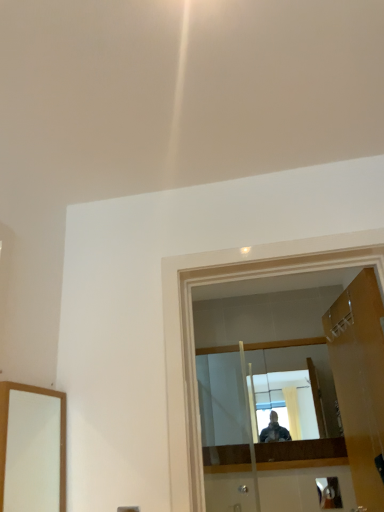
The width and height of the screenshot is (384, 512). Describe the element at coordinates (194, 346) in the screenshot. I see `transparent glass door at center` at that location.

What are the coordinates of `metallic silver door handle at lower right` in the screenshot? It's located at (329, 493).

Is wooden door at right located outside metallic silver door handle at lower right?

Yes, wooden door at right is not within metallic silver door handle at lower right.

From a real-world perspective, who is located higher, wooden door at right or metallic silver door handle at lower right?

In real-world perspective, wooden door at right is above.

From the image's perspective, is wooden door at right on metallic silver door handle at lower right?

Yes, from the image's perspective, wooden door at right is on top of metallic silver door handle at lower right.

How far apart are wooden door at right and metallic silver door handle at lower right?

wooden door at right is 4.14 feet away from metallic silver door handle at lower right.

Is transparent glass door at center facing away from metallic silver door handle at lower right?

Yes, transparent glass door at center is positioned with its back facing metallic silver door handle at lower right.

How much distance is there between transparent glass door at center and metallic silver door handle at lower right?

transparent glass door at center is 6.04 feet from metallic silver door handle at lower right.

Is transparent glass door at center surrounding metallic silver door handle at lower right?

Actually, metallic silver door handle at lower right is outside transparent glass door at center.

I want to click on glass door that is on the left side of metallic silver door handle at lower right, so click(194, 346).

Which is in front, wooden door at right or transparent glass door at center?

Positioned in front is transparent glass door at center.

Considering the relative sizes of wooden door at right and transparent glass door at center in the image provided, is wooden door at right taller than transparent glass door at center?

Yes.

Are wooden door at right and transparent glass door at center located far from each other?

They are positioned close to each other.

From the image's perspective, is metallic silver door handle at lower right located above transparent glass door at center?

No.

Considering the positions of points (324, 493) and (204, 277), is point (324, 493) closer to camera compared to point (204, 277)?

No, (324, 493) is further to viewer.

From the picture: Considering the sizes of objects metallic silver door handle at lower right and transparent glass door at center in the image provided, who is shorter, metallic silver door handle at lower right or transparent glass door at center?

metallic silver door handle at lower right.

Based on the photo, are transparent glass door at center and wooden door at right far apart?

transparent glass door at center is near wooden door at right, not far away.

Where is `door behind the transparent glass door at center`? This screenshot has height=512, width=384. door behind the transparent glass door at center is located at coordinates (360, 382).

From the image's perspective, is transparent glass door at center above or below wooden door at right?

From the image's perspective, transparent glass door at center appears above wooden door at right.

Considering the relative sizes of transparent glass door at center and wooden door at right in the image provided, is transparent glass door at center smaller than wooden door at right?

Incorrect, transparent glass door at center is not smaller in size than wooden door at right.

Measure the distance from metallic silver door handle at lower right to wooden door at right.

They are 1.26 meters apart.

Is metallic silver door handle at lower right placed right next to wooden door at right?

There is a gap between metallic silver door handle at lower right and wooden door at right.

Between point (338, 481) and point (356, 293), which one is positioned behind?

The point (338, 481) is behind.

Is metallic silver door handle at lower right looking in the opposite direction of wooden door at right?

metallic silver door handle at lower right does not have its back to wooden door at right.

Where is `reflection on the right of wooden door at right`? This screenshot has width=384, height=512. reflection on the right of wooden door at right is located at coordinates (329, 493).

Where is `reflection below the transparent glass door at center (from the image's perspective)`? Image resolution: width=384 pixels, height=512 pixels. reflection below the transparent glass door at center (from the image's perspective) is located at coordinates [329, 493].

When comparing their distances from transparent glass door at center, does metallic silver door handle at lower right or wooden door at right seem further?

metallic silver door handle at lower right is further to transparent glass door at center.

Which object lies nearer to the anchor point metallic silver door handle at lower right, transparent glass door at center or wooden door at right?

wooden door at right lies closer to metallic silver door handle at lower right than the other object.

Looking at the image, which one is located closer to transparent glass door at center, wooden door at right or metallic silver door handle at lower right?

wooden door at right is positioned closer to the anchor transparent glass door at center.

Consider the image. Based on their spatial positions, is wooden door at right or transparent glass door at center closer to metallic silver door handle at lower right?

The object closer to metallic silver door handle at lower right is wooden door at right.

Based on their spatial positions, is metallic silver door handle at lower right or transparent glass door at center closer to wooden door at right?

transparent glass door at center lies closer to wooden door at right than the other object.

From the image, which object appears to be farther from wooden door at right, transparent glass door at center or metallic silver door handle at lower right?

metallic silver door handle at lower right lies further to wooden door at right than the other object.

In order to click on door between transparent glass door at center and metallic silver door handle at lower right along the z-axis in this screenshot , I will do `click(360, 382)`.